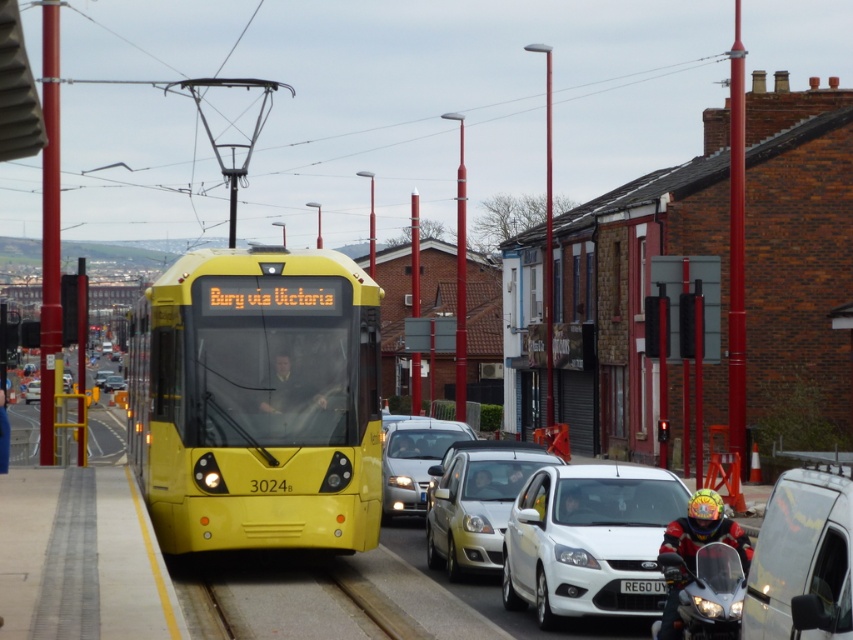
You are a delivery person who needs to place a large package on top of the matte silver sedan at center and the smooth leather helmet at center. Which object can the package be placed on without exceeding its height capacity?

The matte silver sedan at center has a greater height compared to the smooth leather helmet at center, so the package can be placed on the matte silver sedan at center since it is taller and can accommodate the height of the package.

You are a pedestrian standing at point (300, 600) in the image. What material are you standing on?

You are standing on metal at center.

You are a pedestrian standing at the crosswalk and see the matte silver sedan at center and the smooth leather helmet at center. Which object is closer to the ground?

The matte silver sedan at center is located below the smooth leather helmet at center, so it is closer to the ground.